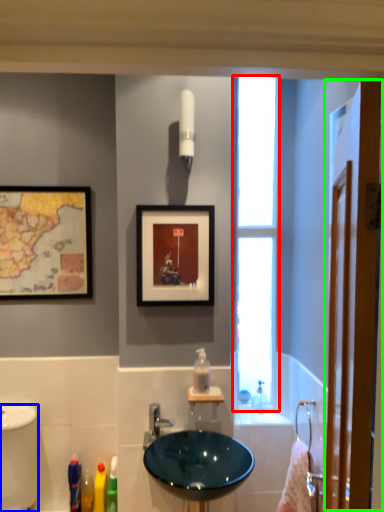
Question: Based on their relative distances, which object is farther from window (highlighted by a red box)? Choose from bidet (highlighted by a blue box) and screen door (highlighted by a green box).

Choices:
 (A) bidet
 (B) screen door

Answer: (B)